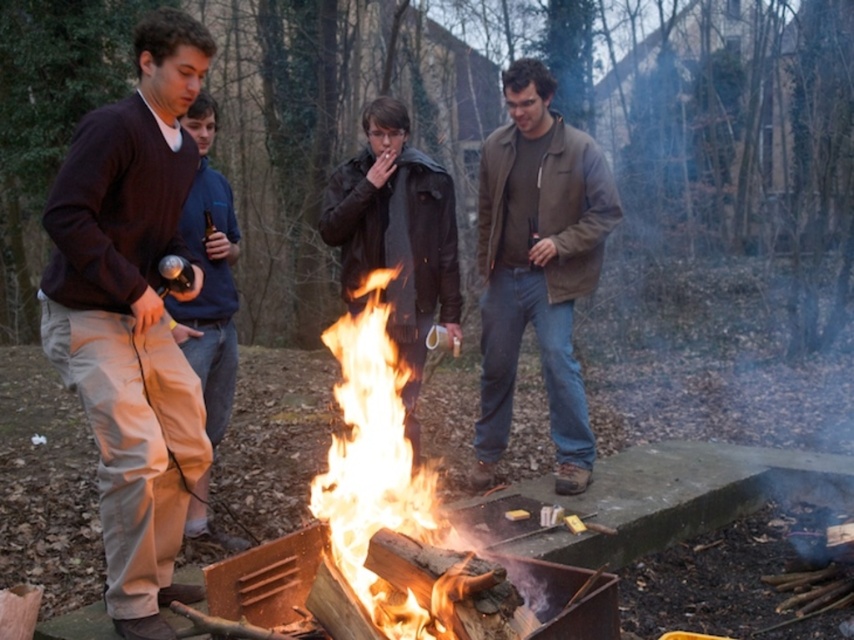
Is flamewoodenfire at center below matte brown pants at left?

Indeed, flamewoodenfire at center is positioned under matte brown pants at left.

The height and width of the screenshot is (640, 854). Describe the element at coordinates (385, 484) in the screenshot. I see `flamewoodenfire at center` at that location.

Find the location of a particular element. flamewoodenfire at center is located at coordinates 385,484.

Does brown leather jacket at center have a lesser width compared to flamewoodenfire at center?

No, brown leather jacket at center is not thinner than flamewoodenfire at center.

Is brown leather jacket at center bigger than flamewoodenfire at center?

Yes, brown leather jacket at center is bigger than flamewoodenfire at center.

Is point (500, 416) in front of point (454, 608)?

That is False.

This screenshot has height=640, width=854. I want to click on brown leather jacket at center, so click(537, 266).

Can you confirm if flamewoodenfire at center is smaller than leather jacket at center?

Yes, flamewoodenfire at center is smaller than leather jacket at center.

Is point (364, 385) less distant than point (355, 200)?

Yes, it is.

The height and width of the screenshot is (640, 854). Identify the location of flamewoodenfire at center. (385, 484).